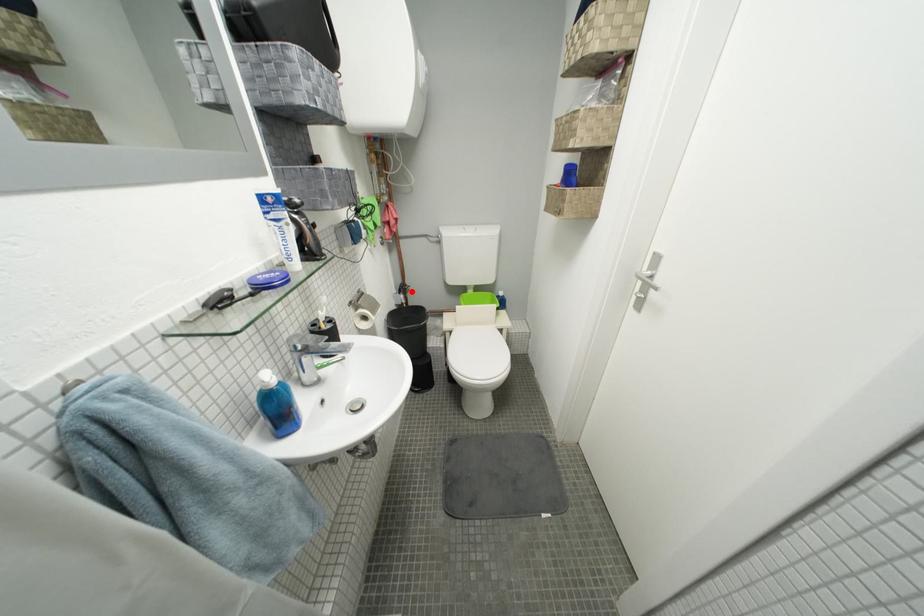
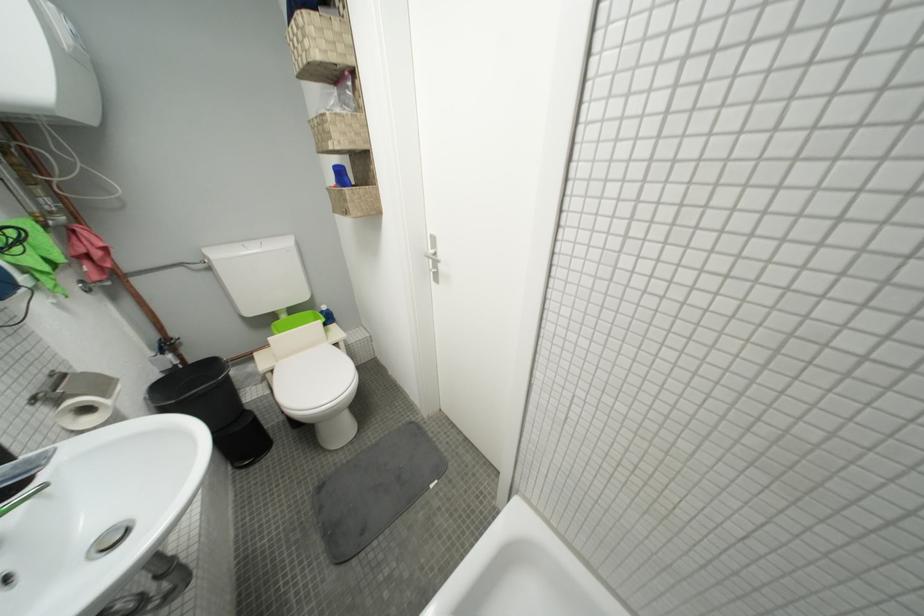
The point at the highlighted location is marked in the first image. Where is the corresponding point in the second image?

(175, 347)